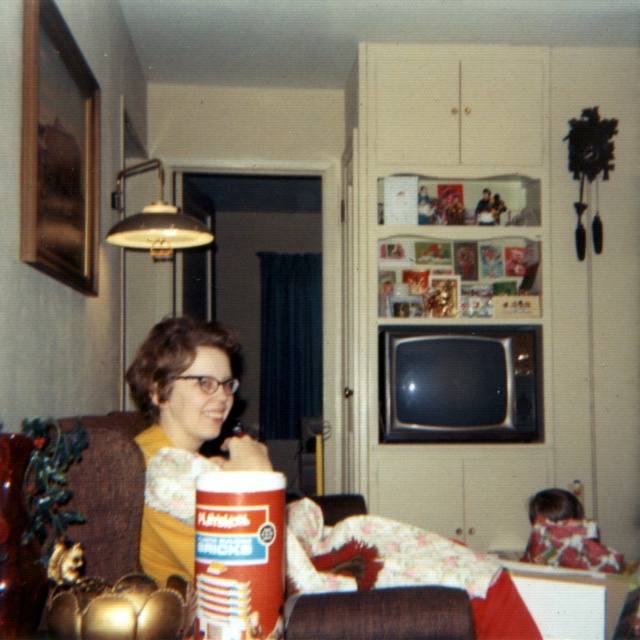
You are a tailor measuring fabrics for alterations. You have a piece of fabric that is exactly the width of the brown cardboard can at lower center. Do you think this fabric will be wide enough to cover the matte yellow blouse at left?

The matte yellow blouse at left might be wider than brown cardboard can at lower center, so the fabric might not be wide enough to cover it.

You are a guest in this living room and want to place a small plant between the matte yellow blouse at left and the brown cardboard can at lower center. Based on their positions, which object should the plant be closer to?

The matte yellow blouse at left is to the right of the brown cardboard can at lower center, so the plant should be placed closer to the brown cardboard can at lower center to be between them.